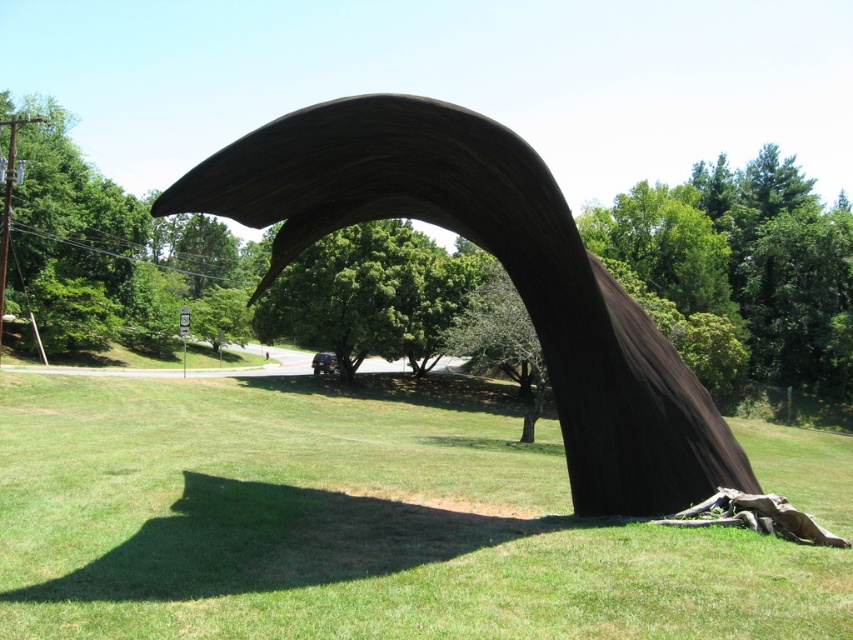
Consider the image. Does green grass at center appear on the left side of rustic wood arch at center?

Indeed, green grass at center is positioned on the left side of rustic wood arch at center.

Between green grass at center and rustic wood arch at center, which one has more height?

rustic wood arch at center

Who is more distant from viewer, (695,621) or (524,193)?

The point (524,193) is behind.

At what (x,y) coordinates should I click in order to perform the action: click on green grass at center. Please return your answer as a coordinate pair (x, y). The image size is (853, 640). Looking at the image, I should click on (347, 525).